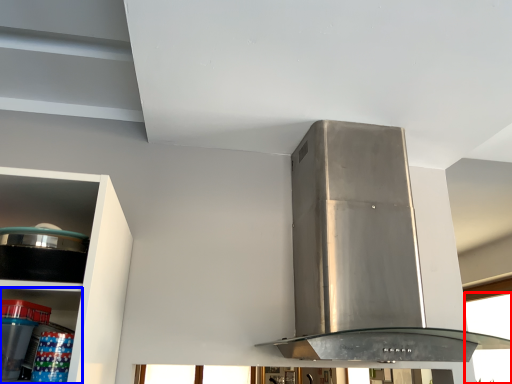
Question: Which point is closer to the camera, window (highlighted by a red box) or shelf (highlighted by a blue box)?

Choices:
 (A) window
 (B) shelf

Answer: (B)